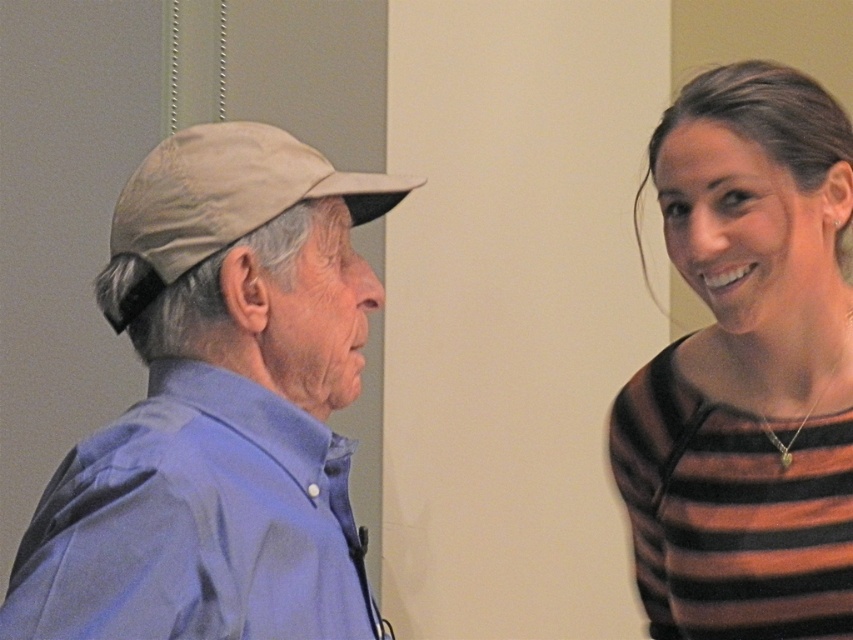
Where is `brown striped sweater at right`? brown striped sweater at right is located at coordinates (747, 369).

Does brown striped sweater at right appear on the left side of tan fabric baseball cap at left?

No, brown striped sweater at right is not to the left of tan fabric baseball cap at left.

What do you see at coordinates (747, 369) in the screenshot? I see `brown striped sweater at right` at bounding box center [747, 369].

You are a GUI agent. You are given a task and a screenshot of the screen. Output one action in this format:
    pyautogui.click(x=<x>, y=<y>)
    Task: Click on the brown striped sweater at right
    Image resolution: width=853 pixels, height=640 pixels.
    Given the screenshot: What is the action you would take?
    pyautogui.click(x=747, y=369)

Looking at this image, is blue smooth shirt at left further to the viewer compared to tan fabric baseball cap at left?

No, blue smooth shirt at left is closer to the viewer.

Does blue smooth shirt at left have a smaller size compared to tan fabric baseball cap at left?

Actually, blue smooth shirt at left might be larger than tan fabric baseball cap at left.

Does point (184, 536) come farther from viewer compared to point (142, 218)?

That is False.

This screenshot has height=640, width=853. I want to click on blue smooth shirt at left, so click(x=195, y=524).

Who is positioned more to the left, matte khaki cap at left or tan fabric baseball cap at left?

From the viewer's perspective, tan fabric baseball cap at left appears more on the left side.

Between matte khaki cap at left and tan fabric baseball cap at left, which one appears on the right side from the viewer's perspective?

matte khaki cap at left

Who is more forward, (x=310, y=566) or (x=212, y=140)?

Point (x=310, y=566) is in front.

Locate an element on the screen. matte khaki cap at left is located at coordinates (218, 406).